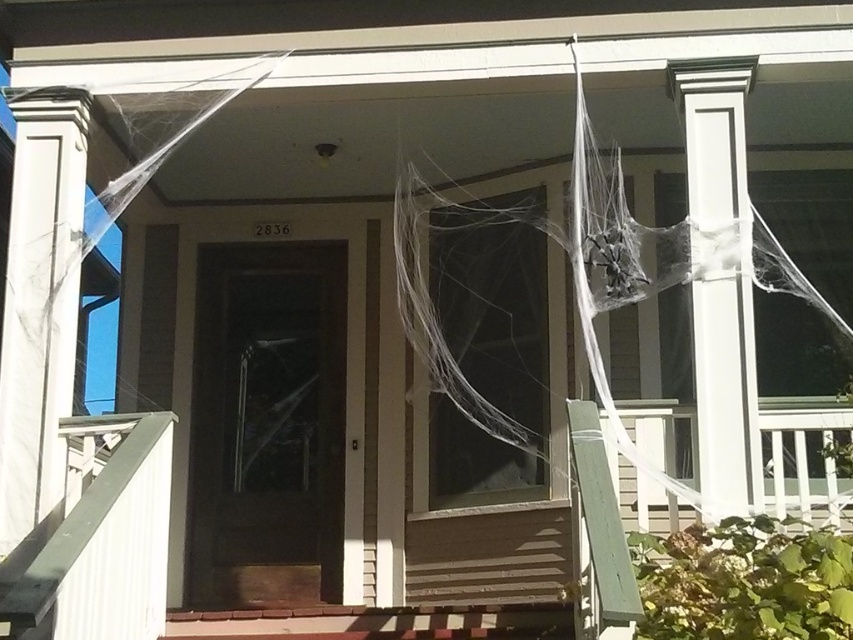
Is dark wood screen door at center above white smooth column at left?

No, dark wood screen door at center is not above white smooth column at left.

Is point (343, 426) behind point (48, 432)?

Yes, point (343, 426) is farther from viewer.

At what (x,y) coordinates should I click in order to perform the action: click on dark wood screen door at center. Please return your answer as a coordinate pair (x, y). Looking at the image, I should click on (267, 426).

How distant is dark wood screen door at center from translucent white spider web at center?

The distance of dark wood screen door at center from translucent white spider web at center is 1.31 meters.

Between point (283, 296) and point (573, 80), which one is positioned behind?

The point (283, 296) is more distant.

Which is in front, point (231, 332) or point (804, 285)?

Point (804, 285) is more forward.

Locate an element on the screen. The height and width of the screenshot is (640, 853). dark wood screen door at center is located at coordinates (267, 426).

Does point (672, 276) lie behind point (44, 406)?

That is True.

What do you see at coordinates (596, 284) in the screenshot?
I see `translucent white spider web at center` at bounding box center [596, 284].

This screenshot has width=853, height=640. What are the coordinates of `translucent white spider web at center` in the screenshot? It's located at (596, 284).